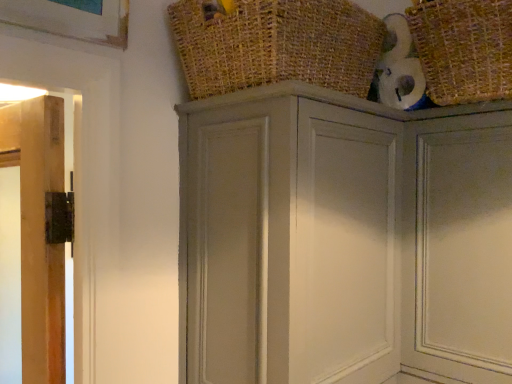
Question: Is burlap basket at upper center, placed as the first basket when sorted from left to right, spatially inside woven straw basket at upper right, which is counted as the 1th basket, starting from the right, or outside of it?

Choices:
 (A) inside
 (B) outside

Answer: (B)

Question: Does point (224, 23) appear closer or farther from the camera than point (480, 76)?

Choices:
 (A) closer
 (B) farther

Answer: (A)

Question: Considering the real-world distances, which object is closest to the matte gray door at upper right?

Choices:
 (A) woven straw basket at upper right, which ranks as the second basket in left-to-right order
 (B) matte gray cupboard at upper center
 (C) burlap basket at upper center, the second basket viewed from the right

Answer: (B)

Question: Which object is the farthest from the burlap basket at upper center, placed as the first basket when sorted from left to right?

Choices:
 (A) woven straw basket at upper right, which ranks as the second basket in left-to-right order
 (B) matte gray door at upper right
 (C) matte gray cupboard at upper center

Answer: (B)